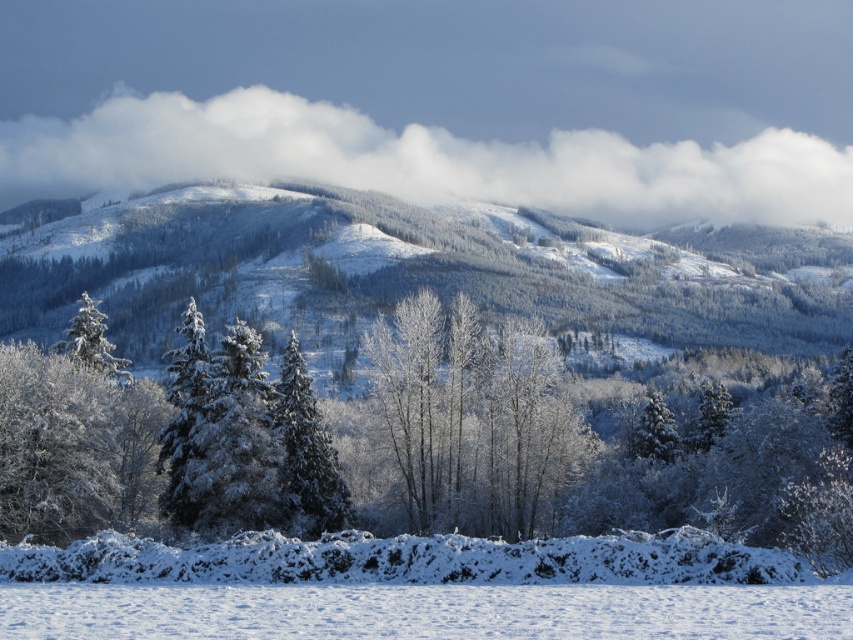
Between white fluffy cloud at upper center and white fluffy snow at lower center, which one has less height?

With less height is white fluffy snow at lower center.

Is point (752, 166) closer to camera compared to point (519, 589)?

No.

Does point (727, 186) come farther from viewer compared to point (97, 588)?

Yes, it is behind point (97, 588).

The height and width of the screenshot is (640, 853). What are the coordinates of `white fluffy cloud at upper center` in the screenshot? It's located at (424, 161).

Can you confirm if snow-covered mountain at upper center is bigger than white fluffy snow at lower center?

Correct, snow-covered mountain at upper center is larger in size than white fluffy snow at lower center.

Which of these two, snow-covered mountain at upper center or white fluffy snow at lower center, stands taller?

Standing taller between the two is snow-covered mountain at upper center.

This screenshot has width=853, height=640. Find the location of `snow-covered mountain at upper center`. snow-covered mountain at upper center is located at coordinates (424, 266).

Find the location of `snow-covered mountain at upper center`. snow-covered mountain at upper center is located at coordinates (424, 266).

Can you confirm if snow-covered mountain at upper center is taller than green matte evergreen tree at center?

Correct, snow-covered mountain at upper center is much taller as green matte evergreen tree at center.

Which is behind, point (0, 317) or point (289, 394)?

Positioned behind is point (0, 317).

Is point (331, 307) less distant than point (328, 449)?

That is False.

Locate an element on the screen. The width and height of the screenshot is (853, 640). snow-covered mountain at upper center is located at coordinates (424, 266).